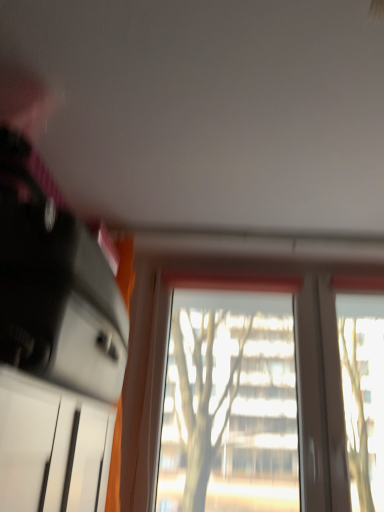
What do you see at coordinates (272, 398) in the screenshot?
I see `transparent glass window at center` at bounding box center [272, 398].

Find the location of a particular element. transparent glass window at center is located at coordinates (272, 398).

I want to click on transparent glass window at center, so click(x=272, y=398).